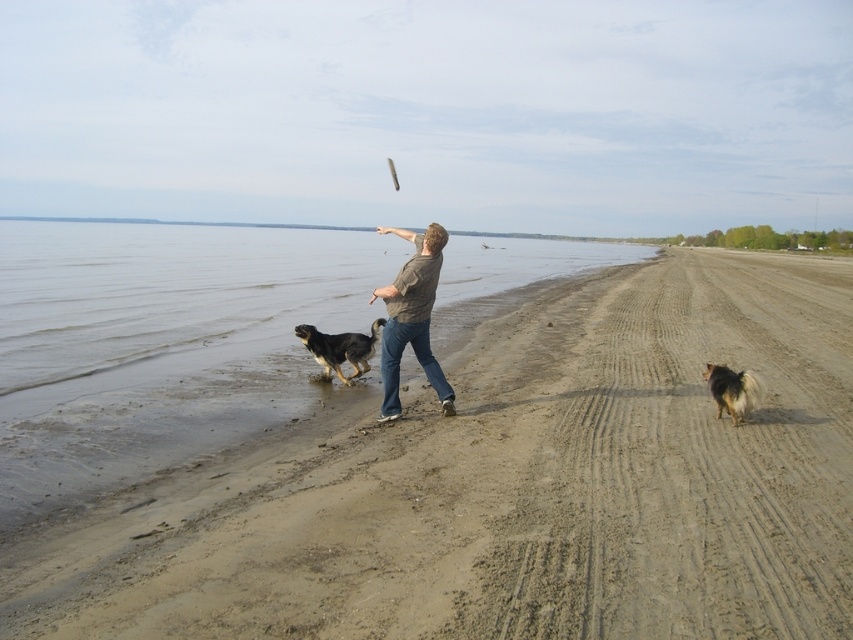
Question: Among these objects, which one is farthest from the camera?

Choices:
 (A) gray cotton shirt at center
 (B) black and white fur dog at center

Answer: (B)

Question: Which object is positioned closest to the white plastic frisbee at center?

Choices:
 (A) sandy brown beach at center
 (B) fluffy brown dog at right

Answer: (A)

Question: Is brown sand at lower left thinner than white plastic frisbee at center?

Choices:
 (A) no
 (B) yes

Answer: (A)

Question: Is sandy brown beach at center thinner than brown sand at lower left?

Choices:
 (A) no
 (B) yes

Answer: (B)

Question: Does black and white fur dog at center have a lesser width compared to fluffy brown dog at right?

Choices:
 (A) no
 (B) yes

Answer: (A)

Question: Which point is farther to the camera?

Choices:
 (A) (750, 380)
 (B) (161, 628)

Answer: (A)